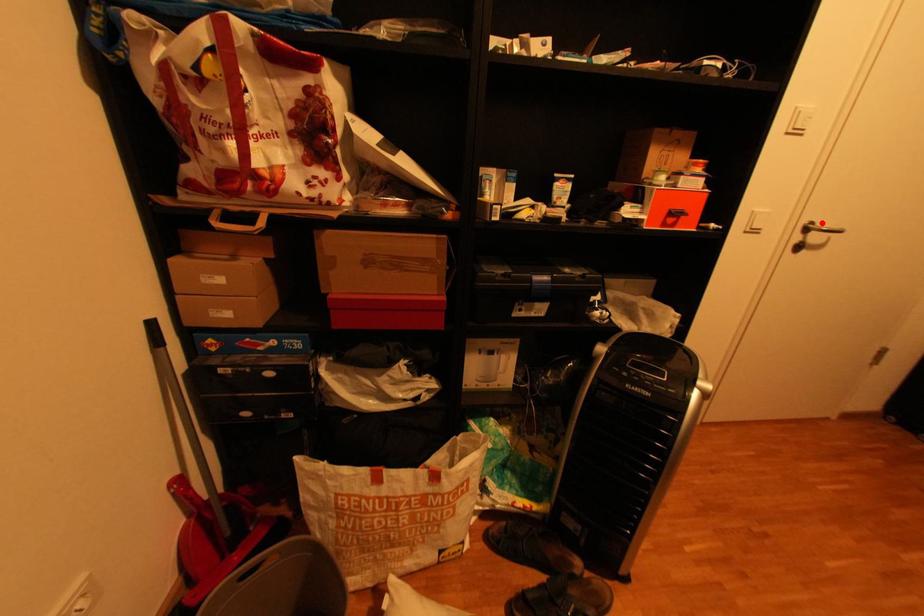
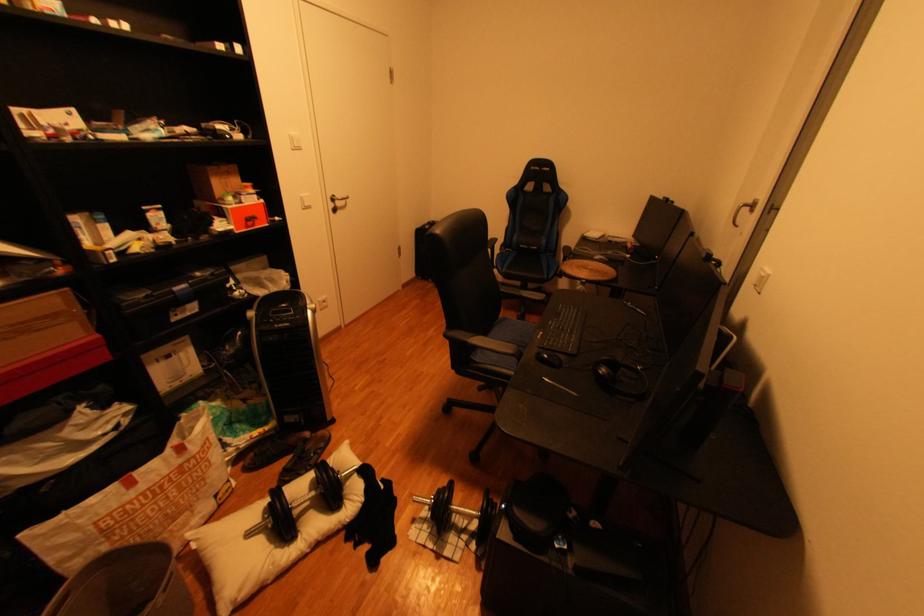
Where in the second image is the point corresponding to the highlighted location from the first image?

(345, 197)